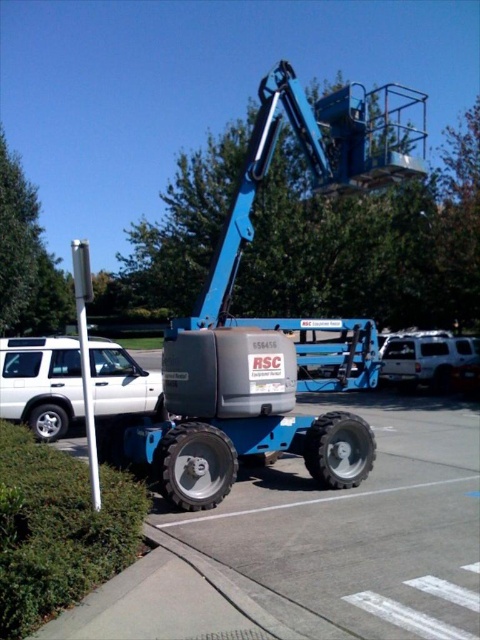
Is white matte suv at lower left above white matte suv at right?

Yes, white matte suv at lower left is above white matte suv at right.

Does point (7, 388) lie behind point (456, 349)?

No, it is in front of (456, 349).

You are a GUI agent. You are given a task and a screenshot of the screen. Output one action in this format:
    pyautogui.click(x=<x>, y=<y>)
    Task: Click on the white matte suv at lower left
    Image resolution: width=480 pixels, height=640 pixels.
    Given the screenshot: What is the action you would take?
    pyautogui.click(x=40, y=384)